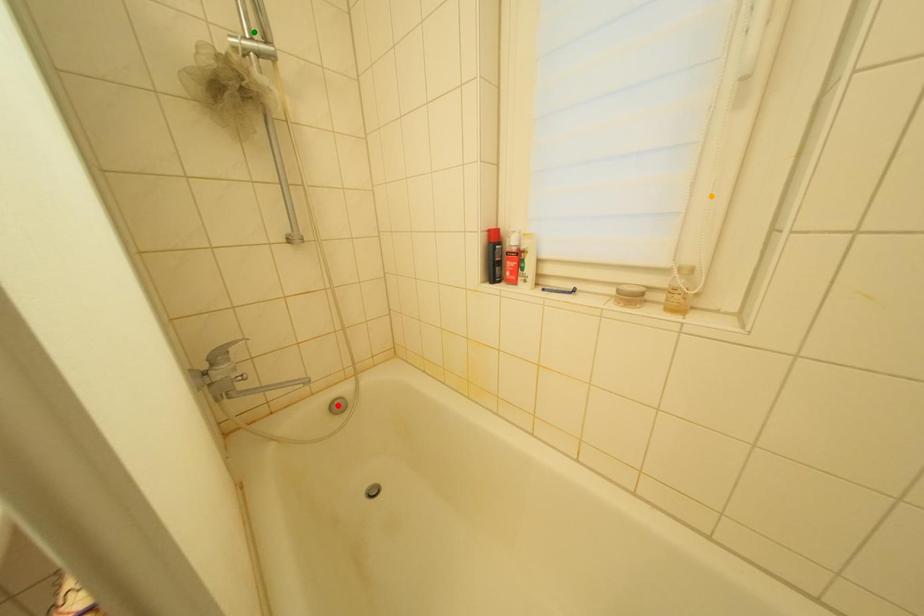
Order these from nearest to farthest:
red point, orange point, green point

orange point
green point
red point